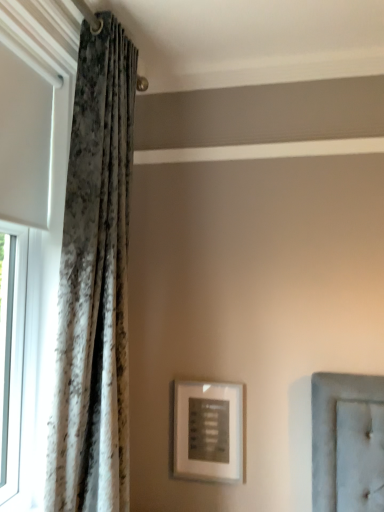
Question: Would you say velvet-like curtain at left is to the left or to the right of matte silver picture frame at center in the picture?

Choices:
 (A) left
 (B) right

Answer: (A)

Question: Is velvet-like curtain at left situated inside matte silver picture frame at center or outside?

Choices:
 (A) outside
 (B) inside

Answer: (A)

Question: Which is nearer to the white textured curtain at left?

Choices:
 (A) velvet-like curtain at left
 (B) matte silver picture frame at center

Answer: (A)

Question: Based on their relative distances, which object is nearer to the velvet-like curtain at left?

Choices:
 (A) white textured curtain at left
 (B) matte silver picture frame at center

Answer: (A)